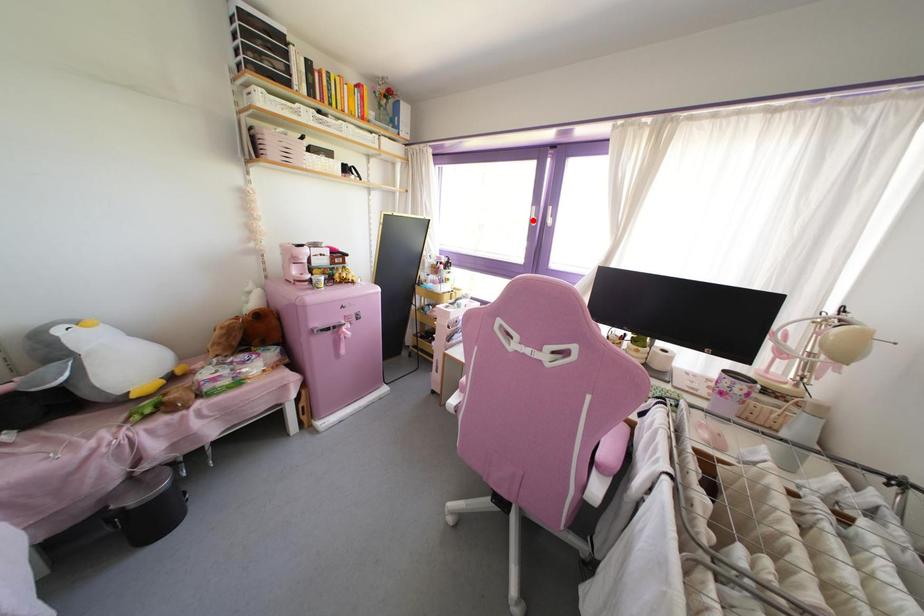
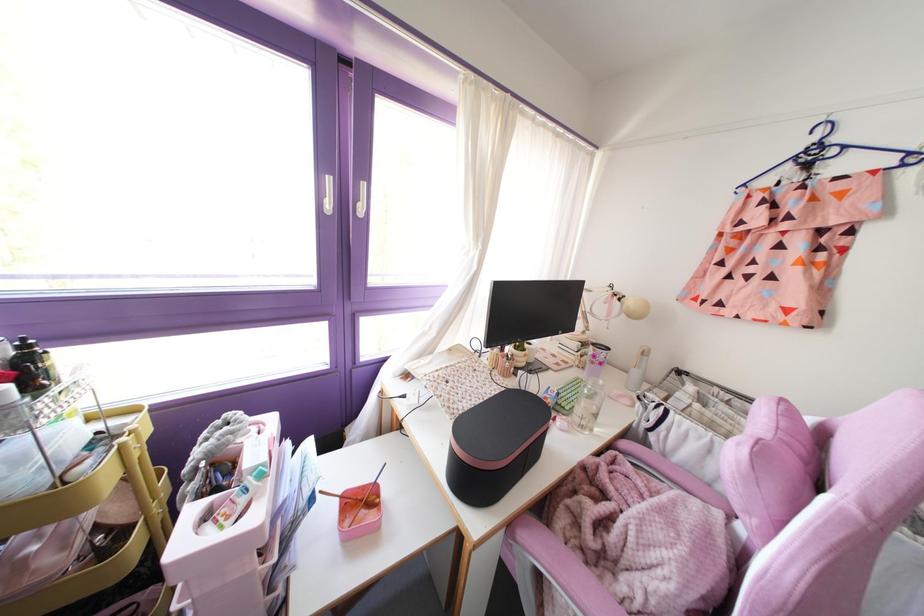
Where in the second image is the point corresponding to the highlighted location from the first image?

(329, 205)